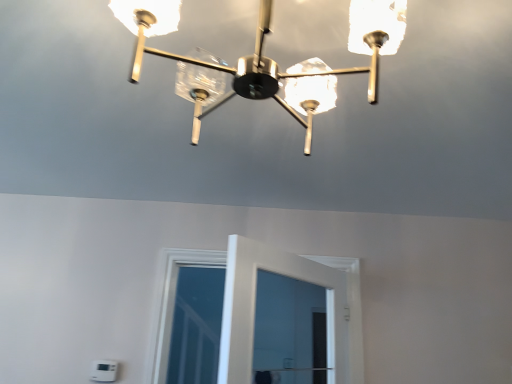
What do you see at coordinates (270, 59) in the screenshot? Image resolution: width=512 pixels, height=384 pixels. I see `metallic glass chandelier at upper center` at bounding box center [270, 59].

The image size is (512, 384). I want to click on metallic glass chandelier at upper center, so (270, 59).

At what (x,y) coordinates should I click in order to perform the action: click on metallic glass chandelier at upper center. Please return your answer as a coordinate pair (x, y). This screenshot has width=512, height=384. Looking at the image, I should click on (270, 59).